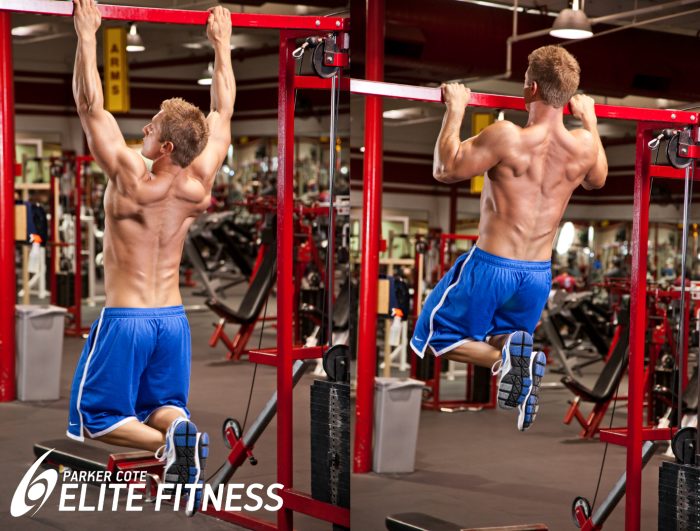
Where is `bench`? bench is located at coordinates (418, 526), (64, 451).